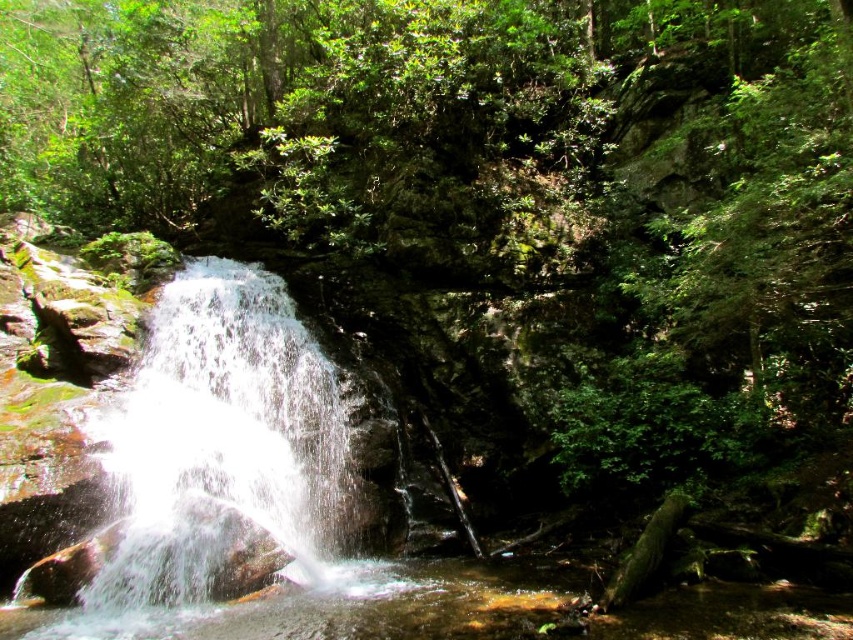
Is point (300, 412) positioned behind point (410, 604)?

Yes.

Who is more distant from viewer, (276, 438) or (666, 600)?

The point (276, 438) is behind.

Identify the location of white frothy water at center. This screenshot has width=853, height=640. (223, 445).

Find the location of a particular element. This screenshot has width=853, height=640. white frothy water at center is located at coordinates (223, 445).